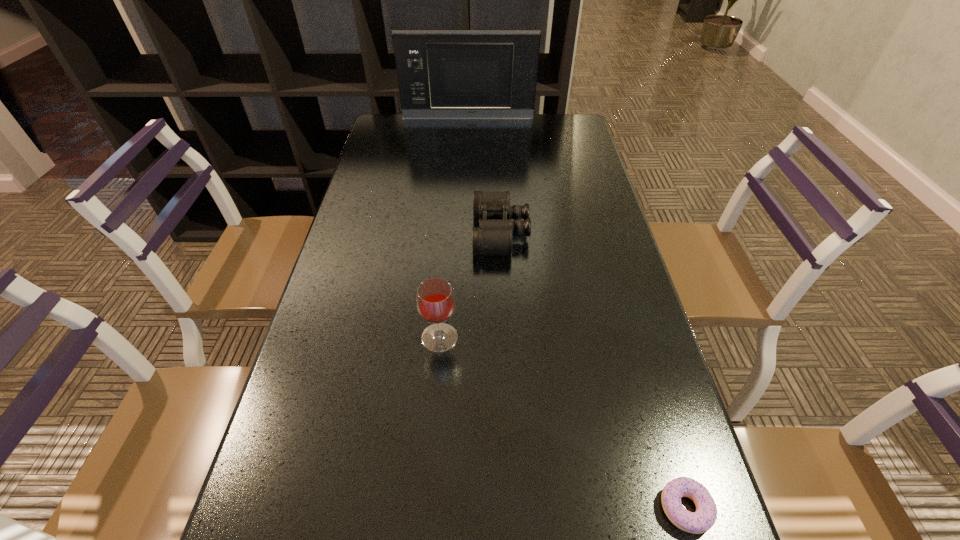
The image size is (960, 540). Identify the location of vacant space at the right edge of the desktop. (585, 232).

In the image, there is a desktop. Identify the location of free region at the far left corner. Image resolution: width=960 pixels, height=540 pixels. (420, 125).

Where is `unoccupied position between the doughnut and the microwave oven`? unoccupied position between the doughnut and the microwave oven is located at coordinates (577, 313).

Where is `vacant space that's between the second farthest object and the tallest object`? The width and height of the screenshot is (960, 540). vacant space that's between the second farthest object and the tallest object is located at coordinates (485, 175).

What are the coordinates of `vacant space that's between the microwave oven and the binoculars` in the screenshot? It's located at (485, 175).

Find the location of a particular element. vacant space that is in between the shortest object and the binoculars is located at coordinates (593, 370).

At what (x,y) coordinates should I click in order to perform the action: click on free space between the wineglass and the second farthest object. Please return your answer as a coordinate pair (x, y). This screenshot has width=960, height=540. Looking at the image, I should click on (470, 285).

Identify the location of free area in between the tallest object and the second tallest object. (454, 228).

The width and height of the screenshot is (960, 540). Find the location of `vacant space that's between the rightmost object and the farthest object`. vacant space that's between the rightmost object and the farthest object is located at coordinates (577, 313).

What are the coordinates of `vacant area between the wineglass and the second farthest object` in the screenshot? It's located at (470, 285).